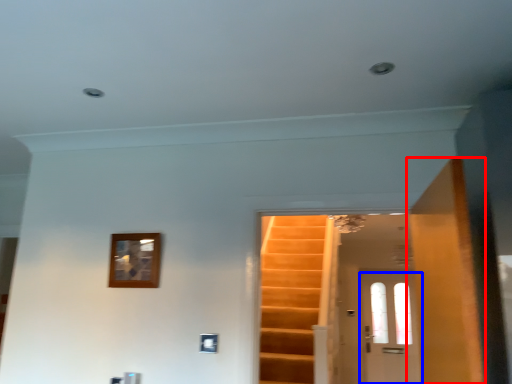
Question: Which of the following is the farthest to the observer, door (highlighted by a red box) or door (highlighted by a blue box)?

Choices:
 (A) door
 (B) door

Answer: (B)